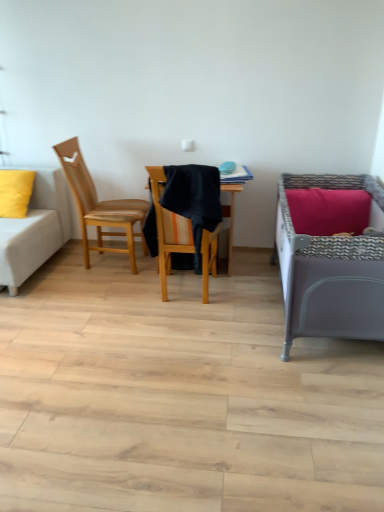
Question: Based on their positions, is white fabric couch at left located to the left or right of wooden chair at left, the second chair from the right?

Choices:
 (A) right
 (B) left

Answer: (B)

Question: From the image's perspective, relative to wooden chair at left, the second chair from the right, is white fabric couch at left above or below?

Choices:
 (A) below
 (B) above

Answer: (A)

Question: Which is nearer to the white fabric couch at left?

Choices:
 (A) matte yellow pillow at left
 (B) wooden chair at center, which is the second chair from left to right
 (C) wooden chair at left, which is counted as the 1th chair, starting from the left
 (D) gray fabric infant bed at right

Answer: (A)

Question: Considering the real-world distances, which object is farthest from the wooden chair at left, the second chair from the right?

Choices:
 (A) wooden chair at center, which is the second chair from left to right
 (B) gray fabric infant bed at right
 (C) white fabric couch at left
 (D) matte yellow pillow at left

Answer: (B)